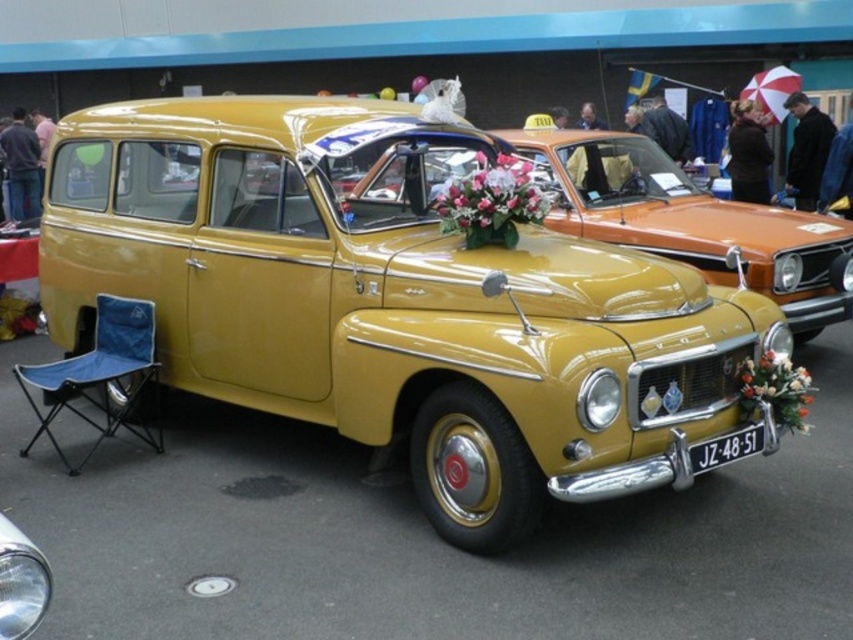
Can you confirm if shiny yellow car at center is positioned to the left of matte yellow car at center?

Indeed, shiny yellow car at center is positioned on the left side of matte yellow car at center.

Can you confirm if shiny yellow car at center is thinner than matte yellow car at center?

Incorrect, shiny yellow car at center's width is not less than matte yellow car at center's.

Does point (375, 120) lie behind point (662, 152)?

That is False.

Where is `shiny yellow car at center`? The height and width of the screenshot is (640, 853). shiny yellow car at center is located at coordinates (392, 301).

Is matte yellow car at center further to camera compared to black plastic license plate at lower center?

That is True.

Between point (784, 304) and point (741, 449), which one is positioned behind?

Point (784, 304)

Does point (642, 202) come behind point (741, 442)?

Yes, point (642, 202) is behind point (741, 442).

The height and width of the screenshot is (640, 853). I want to click on matte yellow car at center, so click(x=689, y=221).

In the scene shown: Is matte yellow car at center below pink silk flowers at center?

No.

Looking at this image, who is positioned more to the right, matte yellow car at center or pink silk flowers at center?

matte yellow car at center is more to the right.

Is point (831, 253) closer to viewer compared to point (496, 202)?

No.

I want to click on matte yellow car at center, so click(x=689, y=221).